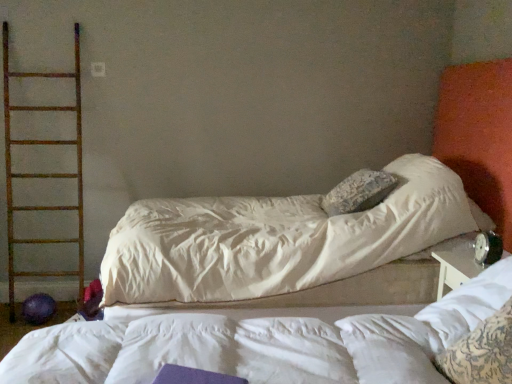
Question: Looking at their shapes, would you say white textured pillow at right is wider or thinner than black plastic alarm clock at right?

Choices:
 (A) thin
 (B) wide

Answer: (B)

Question: In the image, is white textured pillow at right positioned in front of or behind black plastic alarm clock at right?

Choices:
 (A) behind
 (B) front

Answer: (B)

Question: Based on their relative distances, which object is farther from the black plastic alarm clock at right?

Choices:
 (A) white textured pillow at right
 (B) rusty metal ladder at left

Answer: (B)

Question: Based on their relative distances, which object is nearer to the white textured pillow at right?

Choices:
 (A) rusty metal ladder at left
 (B) black plastic alarm clock at right

Answer: (B)